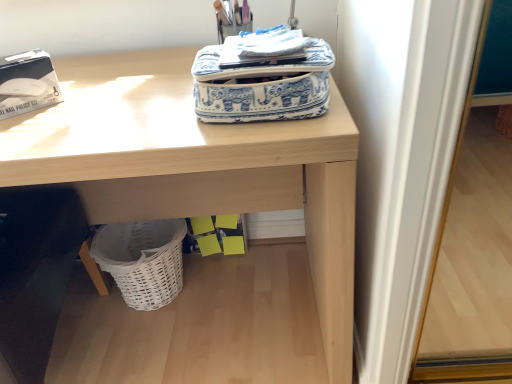
What is the approximate height of blue and white fabric bag at upper center?

blue and white fabric bag at upper center is 4.56 inches in height.

Where is `wooden desk at upper center`? wooden desk at upper center is located at coordinates (195, 166).

Does white wicker basket at lower left contain wooden desk at upper center?

No, wooden desk at upper center is not surrounded by white wicker basket at lower left.

From the image's perspective, relative to wooden desk at upper center, is white wicker basket at lower left above or below?

white wicker basket at lower left is below wooden desk at upper center.

From a real-world perspective, who is located higher, white wicker basket at lower left or wooden desk at upper center?

In real-world perspective, wooden desk at upper center is above.

Is white wicker basket at lower left next to wooden desk at upper center?

No, white wicker basket at lower left is not in contact with wooden desk at upper center.

Are wooden desk at upper center and white wicker basket at lower left located far from each other?

No.

Which is farther, (x=313, y=245) or (x=156, y=247)?

Point (x=313, y=245)

Considering the sizes of objects wooden desk at upper center and white wicker basket at lower left in the image provided, who is bigger, wooden desk at upper center or white wicker basket at lower left?

wooden desk at upper center.

How different are the orientations of wooden desk at upper center and white wicker basket at lower left in degrees?

0.000111 degrees.

Is white wicker basket at lower left facing away from blue and white fabric bag at upper center?

No.

At what (x,y) coordinates should I click in order to perform the action: click on bag above the white wicker basket at lower left (from the image's perspective). Please return your answer as a coordinate pair (x, y). This screenshot has width=512, height=384. Looking at the image, I should click on (262, 77).

From the image's perspective, which is above, white wicker basket at lower left or blue and white fabric bag at upper center?

blue and white fabric bag at upper center is shown above in the image.

From the image's perspective, between blue and white fabric bag at upper center and white wicker basket at lower left, which one is located above?

From the image's view, blue and white fabric bag at upper center is above.

Between blue and white fabric bag at upper center and white wicker basket at lower left, which one appears on the left side from the viewer's perspective?

Positioned to the left is white wicker basket at lower left.

Are blue and white fabric bag at upper center and white wicker basket at lower left far apart?

No, blue and white fabric bag at upper center is not far away from white wicker basket at lower left.

Which object is further away from the camera taking this photo, blue and white fabric bag at upper center or wooden desk at upper center?

wooden desk at upper center.

How different are the orientations of blue and white fabric bag at upper center and wooden desk at upper center in degrees?

0.000165 degrees.

At what (x,y) coordinates should I click in order to perform the action: click on desk located below the blue and white fabric bag at upper center (from the image's perspective). Please return your answer as a coordinate pair (x, y). Looking at the image, I should click on (195, 166).

How much distance is there between blue and white fabric bag at upper center and wooden desk at upper center?

They are 10.27 inches apart.

Considering the relative sizes of wooden desk at upper center and blue and white fabric bag at upper center in the image provided, is wooden desk at upper center shorter than blue and white fabric bag at upper center?

In fact, wooden desk at upper center may be taller than blue and white fabric bag at upper center.

Considering the sizes of objects wooden desk at upper center and blue and white fabric bag at upper center in the image provided, who is smaller, wooden desk at upper center or blue and white fabric bag at upper center?

blue and white fabric bag at upper center.

From the picture: Is wooden desk at upper center with blue and white fabric bag at upper center?

No, wooden desk at upper center is not touching blue and white fabric bag at upper center.

This screenshot has height=384, width=512. I want to click on basket lying below the wooden desk at upper center (from the image's perspective), so coord(143,260).

Identify the location of desk in front of the white wicker basket at lower left. The width and height of the screenshot is (512, 384). (195, 166).

Considering their positions, is blue and white fabric bag at upper center positioned closer to white wicker basket at lower left than wooden desk at upper center?

wooden desk at upper center.

Estimate the real-world distances between objects in this image. Which object is closer to blue and white fabric bag at upper center, wooden desk at upper center or white wicker basket at lower left?

wooden desk at upper center.

When comparing their distances from blue and white fabric bag at upper center, does white wicker basket at lower left or wooden desk at upper center seem closer?

wooden desk at upper center is positioned closer to the anchor blue and white fabric bag at upper center.

Considering their positions, is blue and white fabric bag at upper center positioned closer to wooden desk at upper center than white wicker basket at lower left?

blue and white fabric bag at upper center is positioned closer to the anchor wooden desk at upper center.

In the scene shown: Based on their spatial positions, is wooden desk at upper center or blue and white fabric bag at upper center closer to white wicker basket at lower left?

Among the two, wooden desk at upper center is located nearer to white wicker basket at lower left.

Looking at the image, which one is located closer to wooden desk at upper center, white wicker basket at lower left or blue and white fabric bag at upper center?

blue and white fabric bag at upper center is closer to wooden desk at upper center.

This screenshot has height=384, width=512. Identify the location of desk between blue and white fabric bag at upper center and white wicker basket at lower left along the z-axis. (195, 166).